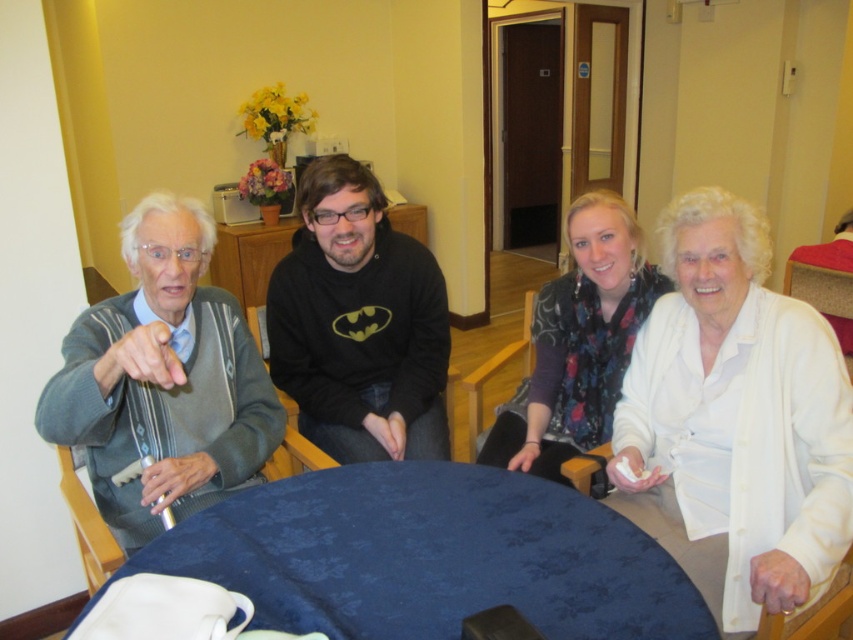
Question: Considering the relative positions of gray striped sweater at left and floral scarf at center in the image provided, where is gray striped sweater at left located with respect to floral scarf at center?

Choices:
 (A) below
 (B) above

Answer: (A)

Question: Does blue fabric table at center appear on the left side of black cotton hoodie at center?

Choices:
 (A) no
 (B) yes

Answer: (A)

Question: Estimate the real-world distances between objects in this image. Which object is closer to the gray striped sweater at left?

Choices:
 (A) black cotton hoodie at center
 (B) blue fabric table at center
 (C) white matte cardigan at right
 (D) floral scarf at center

Answer: (A)

Question: Which of these objects is positioned closest to the white matte cardigan at right?

Choices:
 (A) blue fabric table at center
 (B) floral scarf at center

Answer: (B)

Question: Which is farther from the blue fabric table at center?

Choices:
 (A) gray striped sweater at left
 (B) floral scarf at center
 (C) black cotton hoodie at center
 (D) white matte cardigan at right

Answer: (C)

Question: Can you confirm if gray striped sweater at left is positioned below black cotton hoodie at center?

Choices:
 (A) no
 (B) yes

Answer: (B)